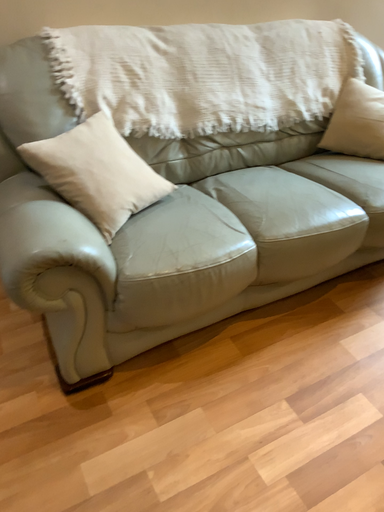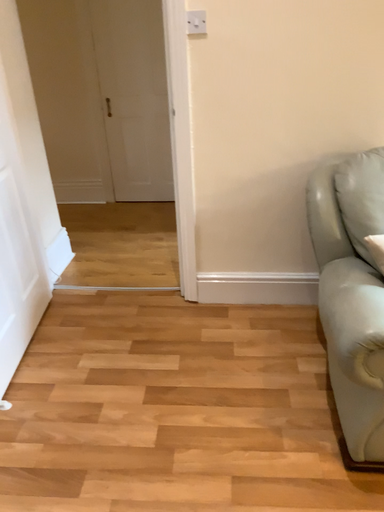
Question: How did the camera likely rotate when shooting the video?

Choices:
 (A) rotated downward
 (B) rotated upward

Answer: (B)